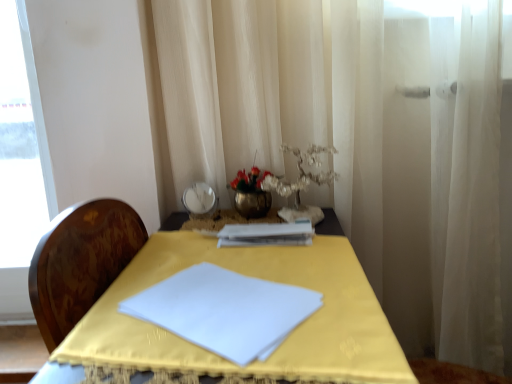
Question: From the image's perspective, is white sheer curtain at right positioned above or below matte silver bowl at upper center?

Choices:
 (A) below
 (B) above

Answer: (A)

Question: Considering the positions of point (508, 132) and point (185, 208), is point (508, 132) closer or farther from the camera than point (185, 208)?

Choices:
 (A) farther
 (B) closer

Answer: (B)

Question: Estimate the real-world distances between objects in this image. Which object is closer to the white sheer curtain at right?

Choices:
 (A) white paper journal at center
 (B) matte silver bowl at upper center
 (C) yellow fabric table at center
 (D) metallic vase at center

Answer: (A)

Question: Based on their relative distances, which object is nearer to the matte silver bowl at upper center?

Choices:
 (A) white sheer curtain at right
 (B) white paper journal at center
 (C) yellow fabric table at center
 (D) metallic vase at center

Answer: (D)